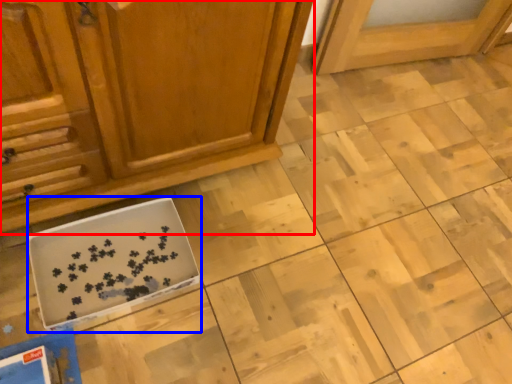
Question: Among these objects, which one is farthest to the camera, cabinetry (highlighted by a red box) or cardboard box (highlighted by a blue box)?

Choices:
 (A) cabinetry
 (B) cardboard box

Answer: (B)